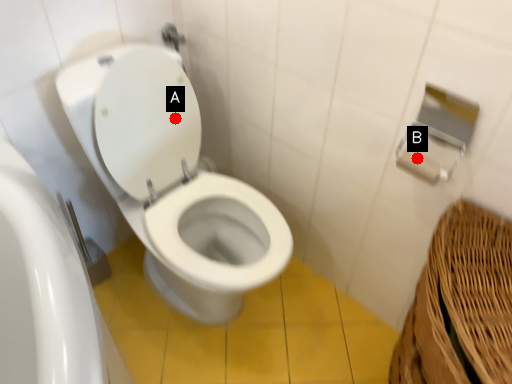
Question: Two points are circled on the image, labeled by A and B beside each circle. Among these points, which one is farthest from the camera?

Choices:
 (A) A is further
 (B) B is further

Answer: (A)